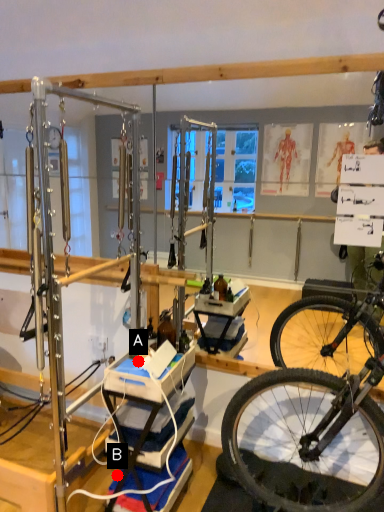
Question: Two points are circled on the image, labeled by A and B beside each circle. Which point appears closest to the camera in this image?

Choices:
 (A) A is closer
 (B) B is closer

Answer: (A)